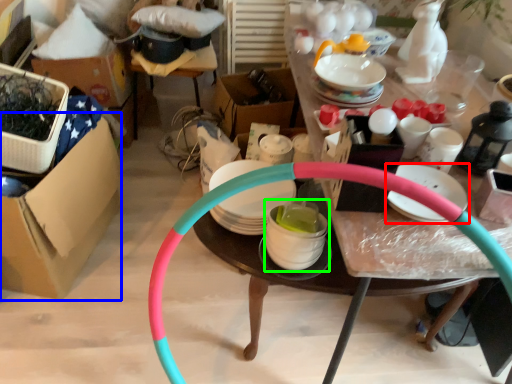
Question: Estimate the real-world distances between objects in this image. Which object is farther from tableware (highlighted by a red box), cardboard box (highlighted by a blue box) or tableware (highlighted by a green box)?

Choices:
 (A) cardboard box
 (B) tableware

Answer: (A)